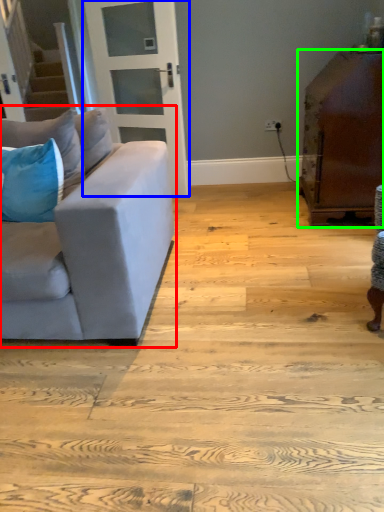
Question: Which object is positioned farthest from studio couch (highlighted by a red box)? Select from door (highlighted by a blue box) and table (highlighted by a green box).

Choices:
 (A) door
 (B) table

Answer: (A)